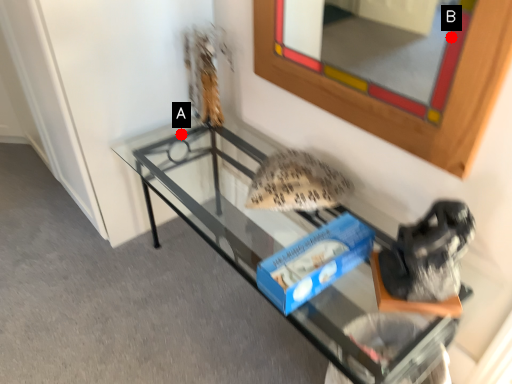
Question: Two points are circled on the image, labeled by A and B beside each circle. Which point is closer to the camera?

Choices:
 (A) A is closer
 (B) B is closer

Answer: (B)